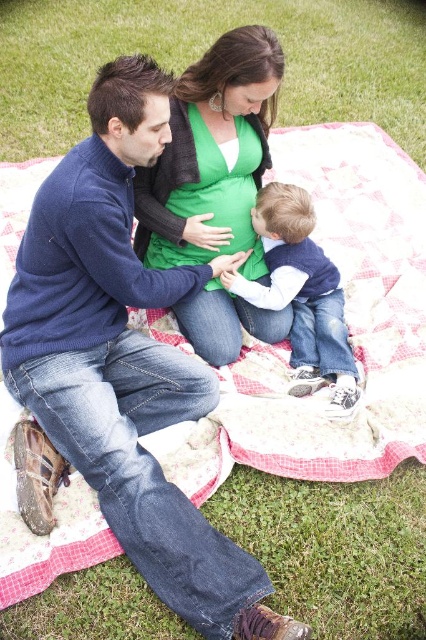
Between blue cotton sweater at center and green grass at center, which one appears on the right side from the viewer's perspective?

Positioned to the right is blue cotton sweater at center.

Does blue cotton sweater at center appear on the left side of green grass at center?

In fact, blue cotton sweater at center is to the right of green grass at center.

Describe the element at coordinates (124, 358) in the screenshot. Image resolution: width=426 pixels, height=640 pixels. I see `blue cotton sweater at center` at that location.

Locate an element on the screen. blue cotton sweater at center is located at coordinates (124, 358).

Is blue cotton sweater at center further to camera compared to denim jeans at center?

No, it is in front of denim jeans at center.

Who is more forward, (49, 257) or (293, 356)?

Point (49, 257) is more forward.

Locate an element on the screen. The image size is (426, 640). blue cotton sweater at center is located at coordinates (124, 358).

Where is `green matte sweater at center`? The width and height of the screenshot is (426, 640). green matte sweater at center is located at coordinates (212, 152).

Does green matte sweater at center have a smaller size compared to denim jeans at center?

Actually, green matte sweater at center might be larger than denim jeans at center.

This screenshot has width=426, height=640. What do you see at coordinates (212, 152) in the screenshot?
I see `green matte sweater at center` at bounding box center [212, 152].

What are the coordinates of `green matte sweater at center` in the screenshot? It's located at (212, 152).